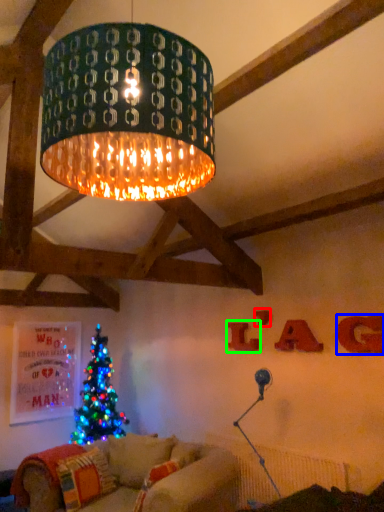
Question: Considering the real-world distances, which object is farthest from letter (highlighted by a red box)? letter (highlighted by a blue box) or letter (highlighted by a green box)?

Choices:
 (A) letter
 (B) letter

Answer: (A)